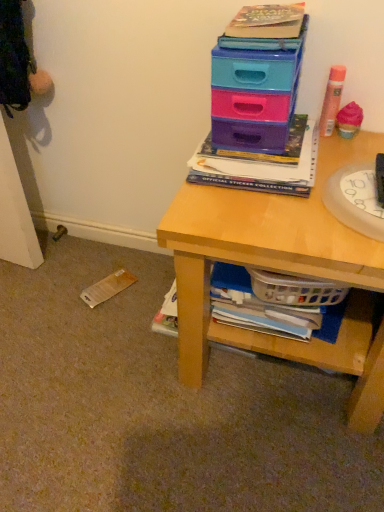
Question: Considering the relative sizes of pink matte hair spray at upper right and matte plastic drawers at upper right in the image provided, is pink matte hair spray at upper right smaller than matte plastic drawers at upper right?

Choices:
 (A) yes
 (B) no

Answer: (A)

Question: Considering the relative sizes of pink matte hair spray at upper right and matte plastic drawers at upper right in the image provided, is pink matte hair spray at upper right bigger than matte plastic drawers at upper right?

Choices:
 (A) yes
 (B) no

Answer: (B)

Question: Is pink matte hair spray at upper right further to the viewer compared to matte plastic drawers at upper right?

Choices:
 (A) yes
 (B) no

Answer: (A)

Question: Can you confirm if pink matte hair spray at upper right is thinner than matte plastic drawers at upper right?

Choices:
 (A) yes
 (B) no

Answer: (A)

Question: From a real-world perspective, is pink matte hair spray at upper right beneath matte plastic drawers at upper right?

Choices:
 (A) no
 (B) yes

Answer: (B)

Question: Is pink matte hair spray at upper right taller than matte plastic drawers at upper right?

Choices:
 (A) no
 (B) yes

Answer: (A)

Question: From a real-world perspective, does matte plastic drawers at upper right stand above hardcover book at upper center?

Choices:
 (A) yes
 (B) no

Answer: (A)

Question: Considering the relative sizes of matte plastic drawers at upper right and hardcover book at upper center in the image provided, is matte plastic drawers at upper right shorter than hardcover book at upper center?

Choices:
 (A) no
 (B) yes

Answer: (A)

Question: Is matte plastic drawers at upper right not close to hardcover book at upper center?

Choices:
 (A) no
 (B) yes

Answer: (A)

Question: From the image's perspective, is matte plastic drawers at upper right on top of hardcover book at upper center?

Choices:
 (A) no
 (B) yes

Answer: (B)

Question: Could you tell me if matte plastic drawers at upper right is turned towards hardcover book at upper center?

Choices:
 (A) no
 (B) yes

Answer: (A)

Question: Does matte plastic drawers at upper right have a smaller size compared to hardcover book at upper center?

Choices:
 (A) yes
 (B) no

Answer: (B)

Question: Considering the relative positions of transparent plastic plate at right and matte plastic drawers at upper right in the image provided, is transparent plastic plate at right to the right of matte plastic drawers at upper right from the viewer's perspective?

Choices:
 (A) yes
 (B) no

Answer: (A)